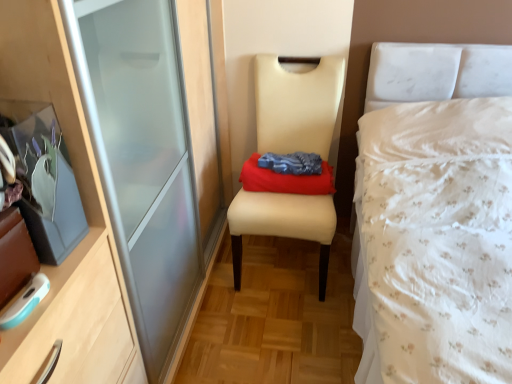
I want to click on free area below beige leather chair at center (from a real-world perspective), so click(x=283, y=262).